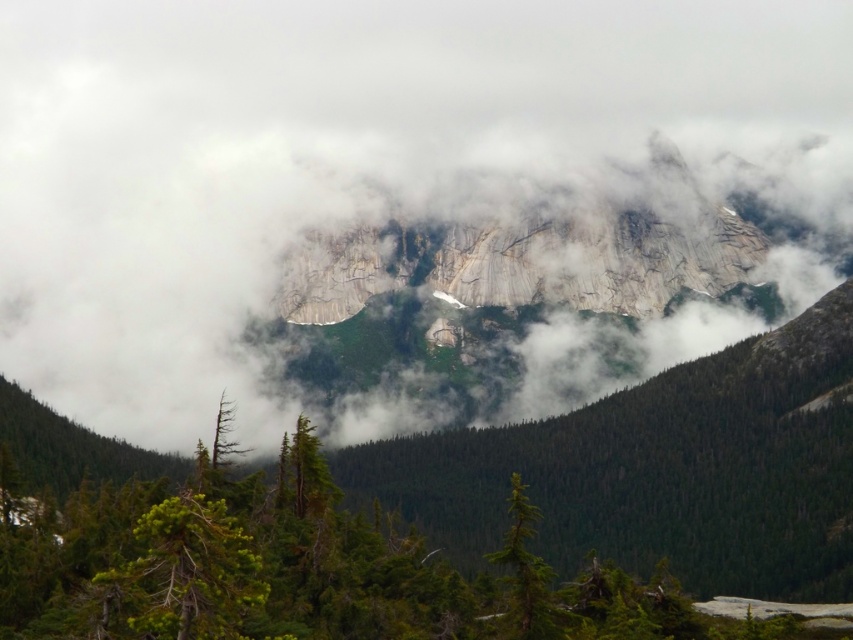
You are standing at the center of the image and want to locate the green matte tree at lower right. According to the coordinates provided, in which direction should you turn to face the tree?

The green matte tree at lower right is located at coordinates point (526, 572), which means it is positioned to the right and slightly below the center of the image. Since you are standing at the center, you should turn to your right and look downward to face the tree.